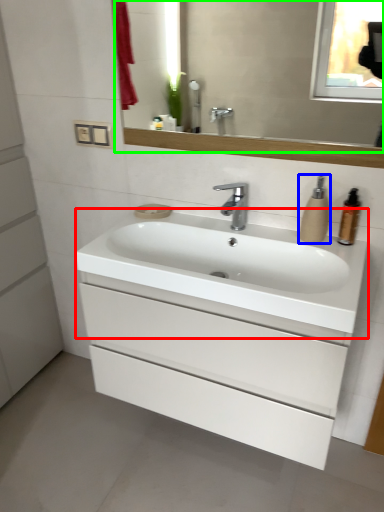
Question: Which object is positioned closest to counter top (highlighted by a red box)? Select from soap dispenser (highlighted by a blue box) and mirror (highlighted by a green box).

Choices:
 (A) soap dispenser
 (B) mirror

Answer: (A)